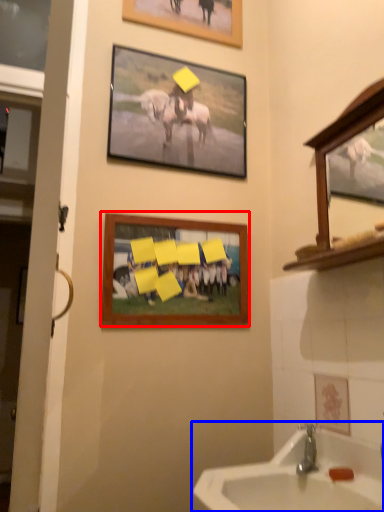
Question: Which object appears closest to the camera in this image, picture frame (highlighted by a red box) or sink (highlighted by a blue box)?

Choices:
 (A) picture frame
 (B) sink

Answer: (B)